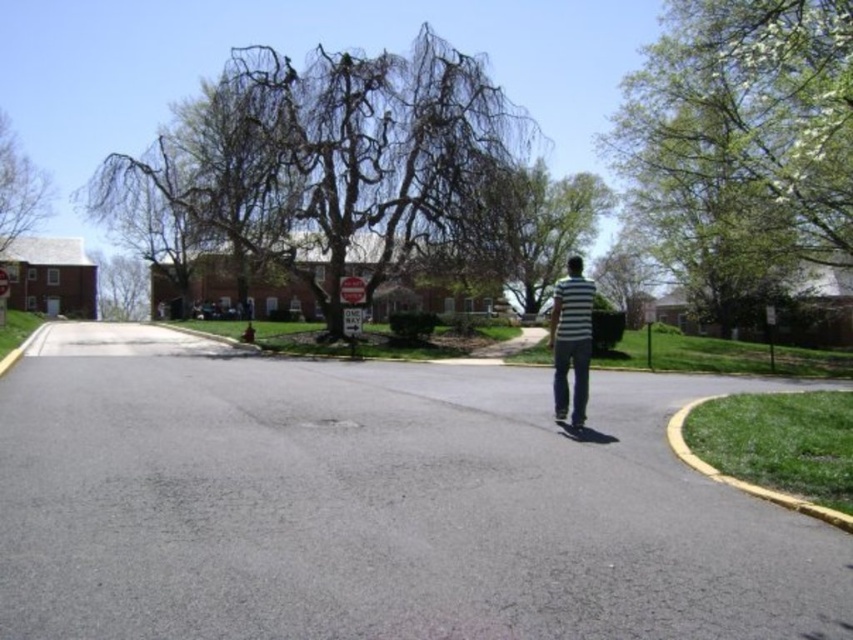
Question: Which object is closer to the camera taking this photo?

Choices:
 (A) dark brown textured tree at upper center
 (B) black rubber skateboard at center
 (C) green leafy tree at upper right

Answer: (B)

Question: Which point appears farthest from the camera in this image?

Choices:
 (A) (16, 148)
 (B) (577, 294)
 (C) (352, 285)

Answer: (A)

Question: Observing the image, what is the correct spatial positioning of dark brown textured tree at upper center in reference to black rubber skateboard at center?

Choices:
 (A) left
 (B) right

Answer: (A)

Question: Considering the real-world distances, which object is closest to the green leafy tree at left?

Choices:
 (A) striped cotton shirt at center
 (B) red metallic stop sign at center
 (C) dark brown textured tree at upper center

Answer: (C)

Question: Does striped cotton shirt at center appear under black rubber skateboard at center?

Choices:
 (A) no
 (B) yes

Answer: (A)

Question: Is dark brown textured tree at upper center bigger than red metallic stop sign at center?

Choices:
 (A) no
 (B) yes

Answer: (B)